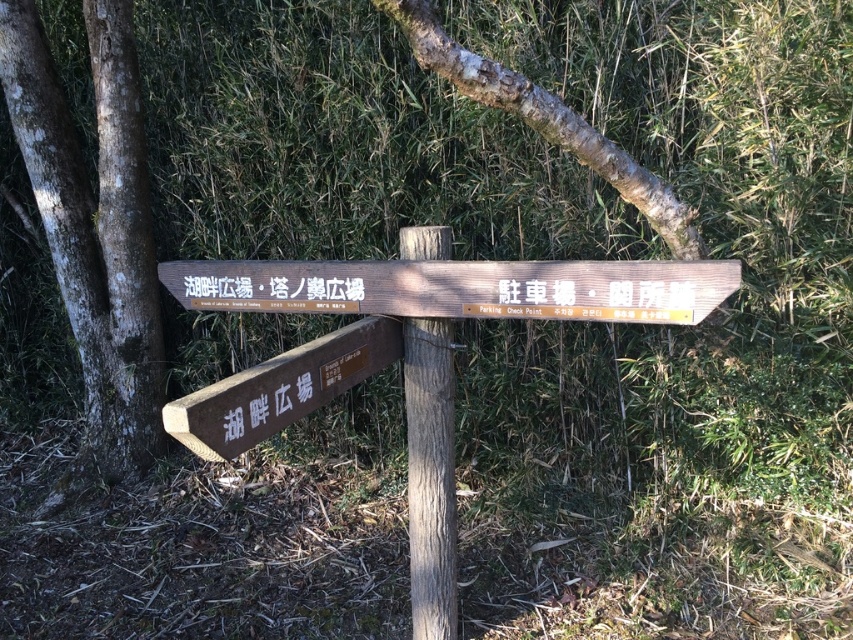
Question: Does brown rough bark tree at left appear over wooden signpost at center?

Choices:
 (A) no
 (B) yes

Answer: (B)

Question: Based on their relative distances, which object is farther from the brown rough bark tree at left?

Choices:
 (A) brown wooden sign at lower left
 (B) wooden sign at center
 (C) wooden signpost at center

Answer: (A)

Question: Does brown rough bark tree at left appear on the left side of wooden sign at center?

Choices:
 (A) yes
 (B) no

Answer: (A)

Question: Can you confirm if wooden sign at center is wider than wooden signpost at center?

Choices:
 (A) no
 (B) yes

Answer: (B)

Question: Which point is farther from the camera taking this photo?

Choices:
 (A) (436, 433)
 (B) (329, 384)
 (C) (708, 268)
 (D) (49, 232)

Answer: (D)

Question: Which object is the closest to the brown rough bark tree at left?

Choices:
 (A) wooden sign at center
 (B) brown wooden sign at lower left

Answer: (A)